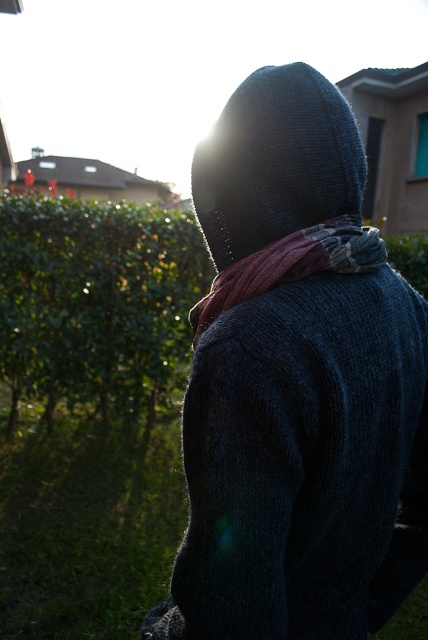
Is point (243, 428) positioned in front of point (303, 99)?

Yes, point (243, 428) is in front of point (303, 99).

How far apart are dark knitted hoodie at center and knitted dark blue at back?

6.55 inches

You are a GUI agent. You are given a task and a screenshot of the screen. Output one action in this format:
    pyautogui.click(x=<x>, y=<y>)
    Task: Click on the dark knitted hoodie at center
    This screenshot has width=428, height=640.
    Given the screenshot: What is the action you would take?
    pyautogui.click(x=297, y=385)

The height and width of the screenshot is (640, 428). Find the location of `dark knitted hoodie at center`. dark knitted hoodie at center is located at coordinates (297, 385).

Does green leafy hedge at left appear under knitted dark blue at back?

Correct, green leafy hedge at left is located below knitted dark blue at back.

Describe the element at coordinates (97, 301) in the screenshot. I see `green leafy hedge at left` at that location.

Where is `green leafy hedge at left`? green leafy hedge at left is located at coordinates (97, 301).

Find the location of a particular element. This screenshot has width=428, height=640. green leafy hedge at left is located at coordinates (97, 301).

Is green leafy hedge at left positioned behind knitted wool scarf at center?

That is True.

Find the location of a particular element. Image resolution: width=428 pixels, height=640 pixels. green leafy hedge at left is located at coordinates (97, 301).

Identify the location of green leafy hedge at left. Image resolution: width=428 pixels, height=640 pixels. (97, 301).